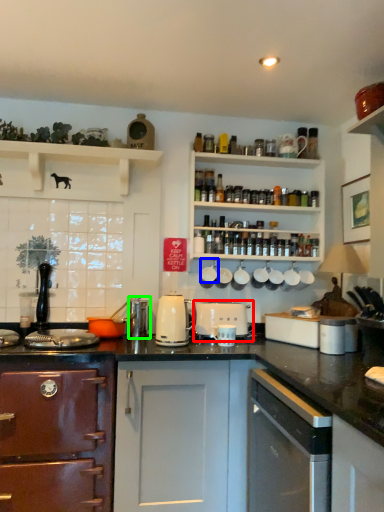
Question: Which is nearer to the appliance (highlighted by a red box)? appliance (highlighted by a blue box) or appliance (highlighted by a green box).

Choices:
 (A) appliance
 (B) appliance

Answer: (A)